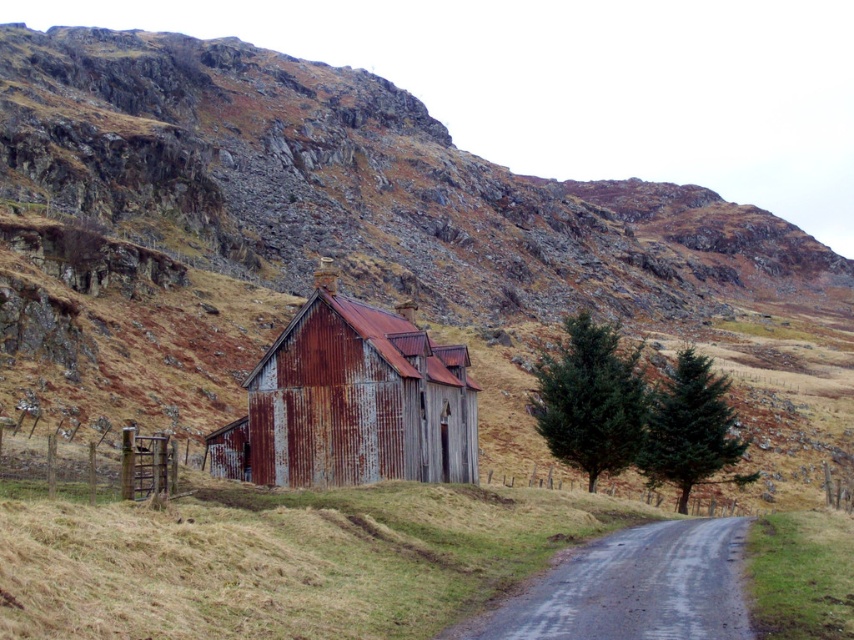
You are standing on the dirt road and want to walk to the green textured tree at right. Which direction should you walk to avoid the rusty corrugated metal barn at center?

The rusty corrugated metal barn at center is located above the green textured tree at right, so to avoid it, you should walk to the right side of the barn towards the tree.

You are standing on the dirt road and looking towards the rusty corrugated metal barn at center and the green matte tree at right. Which object is closer to you?

The rusty corrugated metal barn at center is closer to you since it is positioned in front of the green matte tree at right.

You are a painter standing on the dirt road near the rusty corrugated metal barn at center and the green matte tree at right. You want to paint both objects on a canvas. Which object should you paint first if you want to start with the one that is closer to you?

The rusty corrugated metal barn at center is closer to you than the green matte tree at right, so you should paint the rusty corrugated metal barn at center first.